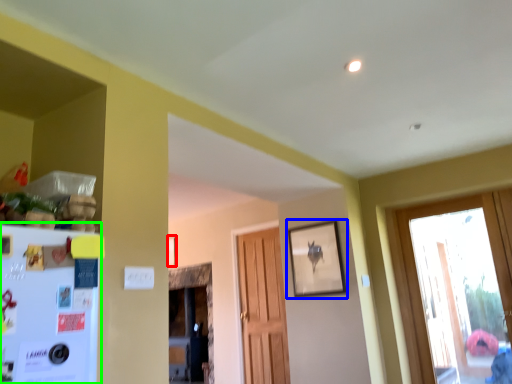
Question: Estimate the real-world distances between objects in this image. Which object is closer to picture frame (highlighted by a red box), picture frame (highlighted by a blue box) or fridge (highlighted by a green box)?

Choices:
 (A) picture frame
 (B) fridge

Answer: (A)